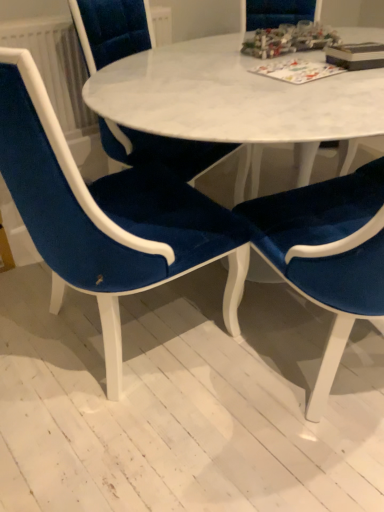
Locate an element on the screen. The image size is (384, 512). vacant space that's between velvet blue chair at lower left, which is the 1th chair from left to right, and velvet blue chair at center, the third chair positioned from the left is located at coordinates (222, 374).